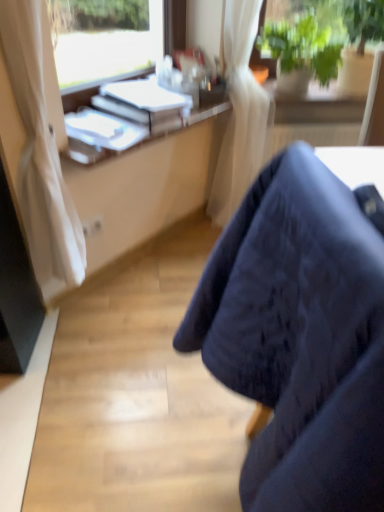
Question: From a real-world perspective, is white plastic desk at upper left on top of white glossy book at upper left, arranged as the second book when viewed from the top?

Choices:
 (A) no
 (B) yes

Answer: (A)

Question: Is white plastic desk at upper left bigger than white glossy book at upper left, arranged as the second book when viewed from the top?

Choices:
 (A) yes
 (B) no

Answer: (A)

Question: Is white plastic desk at upper left to the right of white glossy book at upper left, arranged as the second book when viewed from the top, from the viewer's perspective?

Choices:
 (A) yes
 (B) no

Answer: (A)

Question: Considering the relative sizes of white plastic desk at upper left and white glossy book at upper left, placed as the 1th book when sorted from bottom to top, in the image provided, is white plastic desk at upper left wider than white glossy book at upper left, placed as the 1th book when sorted from bottom to top,?

Choices:
 (A) yes
 (B) no

Answer: (B)

Question: Is white glossy book at upper left, arranged as the second book when viewed from the top, surrounded by white plastic desk at upper left?

Choices:
 (A) no
 (B) yes

Answer: (A)

Question: Based on their positions, is white glossy book at upper left, arranged as the second book when viewed from the top, located to the left or right of white plastic desk at upper left?

Choices:
 (A) right
 (B) left

Answer: (B)

Question: Is point (67, 122) closer or farther from the camera than point (92, 142)?

Choices:
 (A) closer
 (B) farther

Answer: (B)

Question: In terms of height, does white glossy book at upper left, placed as the 1th book when sorted from bottom to top, look taller or shorter compared to white plastic desk at upper left?

Choices:
 (A) short
 (B) tall

Answer: (B)

Question: From a real-world perspective, relative to white plastic desk at upper left, is white glossy book at upper left, placed as the 1th book when sorted from bottom to top, vertically above or below?

Choices:
 (A) below
 (B) above

Answer: (B)

Question: Based on their positions, is white paper at upper center, which ranks as the second book in bottom-to-top order, located to the left or right of dark fabric chair at lower right?

Choices:
 (A) right
 (B) left

Answer: (B)

Question: From the image's perspective, relative to dark fabric chair at lower right, is white paper at upper center, which ranks as the second book in bottom-to-top order, above or below?

Choices:
 (A) below
 (B) above

Answer: (B)

Question: Is white paper at upper center, which ranks as the second book in bottom-to-top order, wider or thinner than dark fabric chair at lower right?

Choices:
 (A) wide
 (B) thin

Answer: (B)

Question: Is point (140, 104) positioned closer to the camera than point (259, 458)?

Choices:
 (A) closer
 (B) farther

Answer: (B)

Question: In the image, is white glossy book at upper left, placed as the 1th book when sorted from bottom to top, on the left side or the right side of white paper at upper center, which is the 1th book from top to bottom?

Choices:
 (A) right
 (B) left

Answer: (B)

Question: Is white glossy book at upper left, placed as the 1th book when sorted from bottom to top, spatially inside white paper at upper center, which is the 1th book from top to bottom, or outside of it?

Choices:
 (A) inside
 (B) outside

Answer: (B)